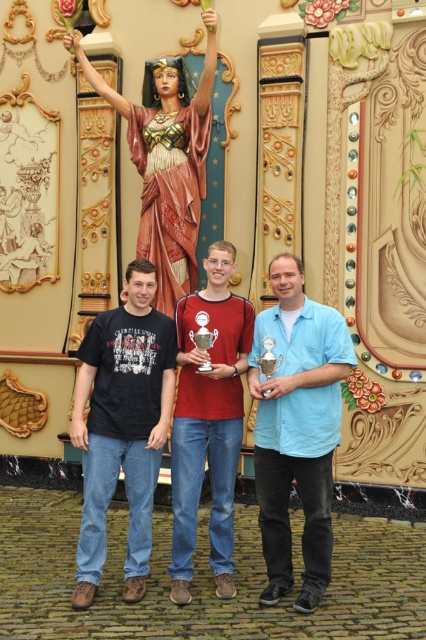
What do you see at coordinates (123, 426) in the screenshot?
I see `black cotton t-shirt at center` at bounding box center [123, 426].

Is black cotton t-shirt at center above matte red shirt at center?

Actually, black cotton t-shirt at center is below matte red shirt at center.

Between point (140, 563) and point (181, 429), which one is positioned behind?

The point (181, 429) is more distant.

Where is `black cotton t-shirt at center`? This screenshot has height=640, width=426. black cotton t-shirt at center is located at coordinates (123, 426).

Who is shorter, black cotton t-shirt at center or wooden statue at center?

With less height is black cotton t-shirt at center.

Is point (155, 355) more distant than point (184, 259)?

No, (155, 355) is closer to viewer.

Identify the location of black cotton t-shirt at center. Image resolution: width=426 pixels, height=640 pixels. (123, 426).

Can you confirm if blue cotton shirt at center is smaller than matte red shirt at center?

No, blue cotton shirt at center is not smaller than matte red shirt at center.

Can you confirm if blue cotton shirt at center is positioned below matte red shirt at center?

Yes.

Is point (270, 436) closer to viewer compared to point (229, 323)?

Yes, point (270, 436) is closer to viewer.

What are the coordinates of `blue cotton shirt at center` in the screenshot? It's located at (296, 428).